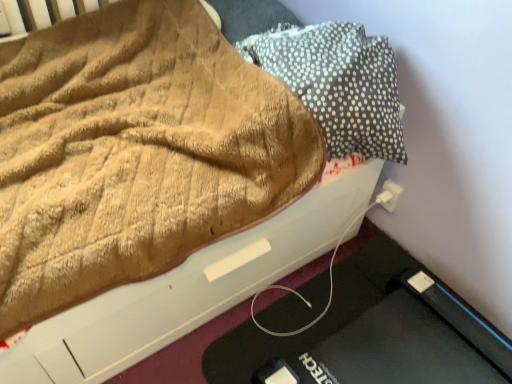
Question: From the image's perspective, relative to dark gray dotted pillow at upper right, is white plastic electric outlet at lower right above or below?

Choices:
 (A) above
 (B) below

Answer: (B)

Question: In terms of height, does white plastic electric outlet at lower right look taller or shorter compared to dark gray dotted pillow at upper right?

Choices:
 (A) short
 (B) tall

Answer: (A)

Question: Is white plastic electric outlet at lower right situated inside dark gray dotted pillow at upper right or outside?

Choices:
 (A) inside
 (B) outside

Answer: (B)

Question: Considering the positions of dark gray dotted pillow at upper right and white plastic electric outlet at lower right in the image, is dark gray dotted pillow at upper right bigger or smaller than white plastic electric outlet at lower right?

Choices:
 (A) small
 (B) big

Answer: (B)

Question: Is dark gray dotted pillow at upper right wider or thinner than white plastic electric outlet at lower right?

Choices:
 (A) thin
 (B) wide

Answer: (B)

Question: Is dark gray dotted pillow at upper right in front of or behind white plastic electric outlet at lower right in the image?

Choices:
 (A) front
 (B) behind

Answer: (A)

Question: From the image's perspective, is dark gray dotted pillow at upper right located above or below white plastic electric outlet at lower right?

Choices:
 (A) below
 (B) above

Answer: (B)